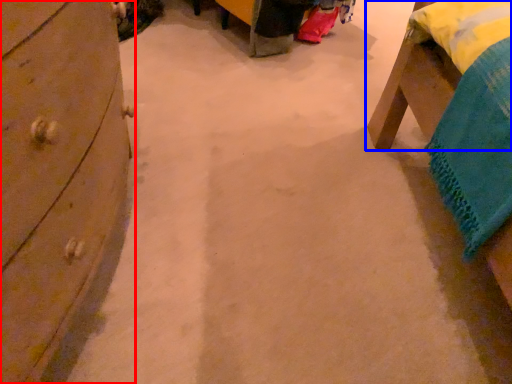
Question: Which point is closer to the camera, chest of drawers (highlighted by a red box) or furniture (highlighted by a blue box)?

Choices:
 (A) chest of drawers
 (B) furniture

Answer: (A)